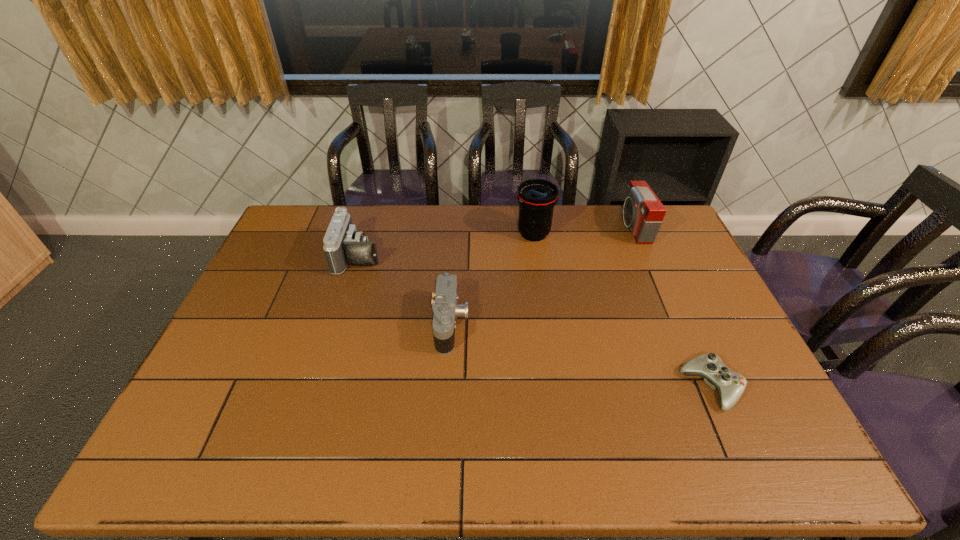
In the image, there is a desktop. Identify the location of free space at the near edge. The height and width of the screenshot is (540, 960). (361, 454).

You are a GUI agent. You are given a task and a screenshot of the screen. Output one action in this format:
    pyautogui.click(x=<x>, y=<y>)
    Task: Click on the vacant space at the left edge
    The width and height of the screenshot is (960, 540).
    Given the screenshot: What is the action you would take?
    pyautogui.click(x=272, y=287)

Where is `free region at the right edge of the desktop`? The image size is (960, 540). free region at the right edge of the desktop is located at coordinates (723, 327).

The height and width of the screenshot is (540, 960). I want to click on free space between the tallest object and the nearest camera, so click(492, 279).

At what (x,y) coordinates should I click in order to perform the action: click on free space that is in between the second camera from right to left and the leftmost camera. Please return your answer as a coordinate pair (x, y). This screenshot has height=540, width=960. Looking at the image, I should click on (405, 289).

Where is `free space between the second camera from left to right and the leftmost object`? This screenshot has height=540, width=960. free space between the second camera from left to right and the leftmost object is located at coordinates (405, 289).

I want to click on unoccupied area between the second object from left to right and the nearest object, so click(x=581, y=355).

In order to click on empty space that is in between the nearest camera and the leftmost object in this screenshot , I will do `click(405, 289)`.

Identify the location of unoccupied position between the rightmost camera and the control. The width and height of the screenshot is (960, 540). (672, 307).

This screenshot has height=540, width=960. Find the location of `vacant point located between the leftmost object and the shortest camera`. vacant point located between the leftmost object and the shortest camera is located at coordinates (405, 289).